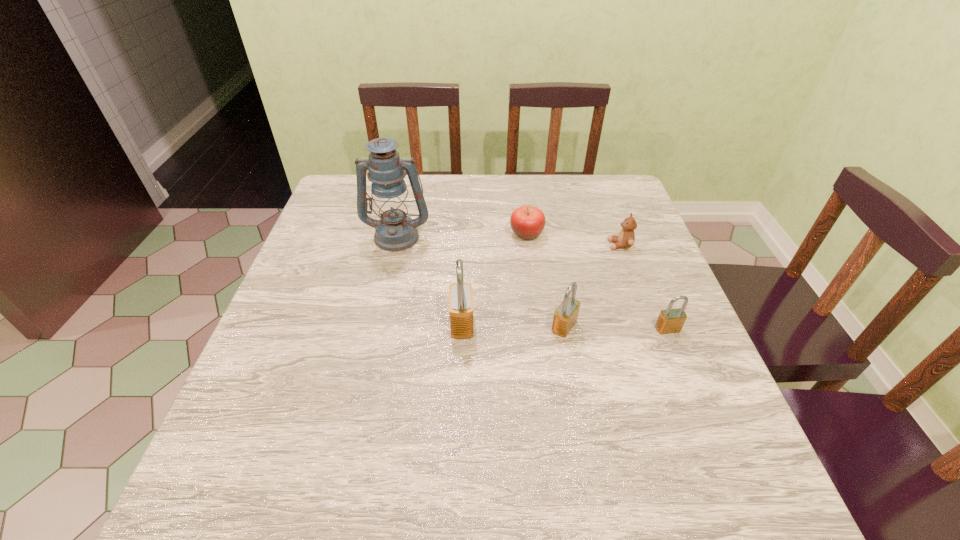
Where is `vacant space at the far edge of the desktop`? The image size is (960, 540). vacant space at the far edge of the desktop is located at coordinates (474, 178).

Identify the location of free spot at the near edge of the desktop. (614, 407).

I want to click on free spot at the left edge of the desktop, so click(x=255, y=354).

Locate an element on the screen. This screenshot has width=960, height=540. free region at the right edge of the desktop is located at coordinates (631, 345).

Where is `free region at the far left corner of the desktop`? free region at the far left corner of the desktop is located at coordinates (344, 202).

Find the location of a particular element. The image size is (960, 540). vacant point at the far right corner is located at coordinates (592, 185).

You are a GUI agent. You are given a task and a screenshot of the screen. Output one action in this format:
    pyautogui.click(x=<x>, y=<y>)
    Task: Click on the free point between the teddy bear and the second object from left to right
    Image resolution: width=960 pixels, height=540 pixels.
    Given the screenshot: What is the action you would take?
    pyautogui.click(x=540, y=285)

The width and height of the screenshot is (960, 540). In order to click on free space between the tallest padlock and the third tallest object in this screenshot , I will do `click(513, 325)`.

Locate an element on the screen. free point between the leftmost padlock and the teddy bear is located at coordinates (540, 285).

Locate an element on the screen. The image size is (960, 540). vacant point located between the rightmost padlock and the second padlock from right to left is located at coordinates (616, 328).